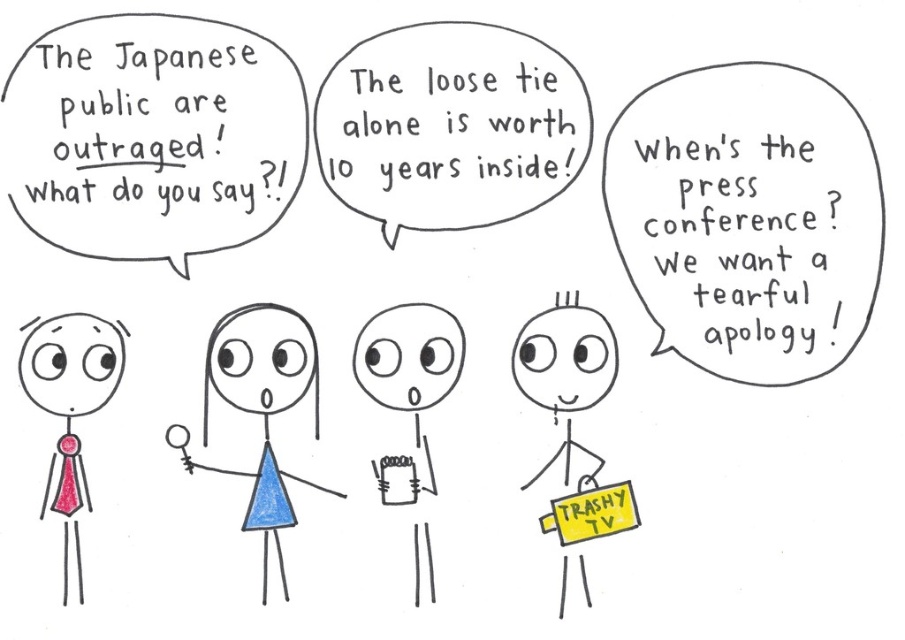
Question: Is yellow paper sign at lower right to the left of blue paper at center from the viewer's perspective?

Choices:
 (A) yes
 (B) no

Answer: (B)

Question: Estimate the real-world distances between objects in this image. Which object is farther from the yellow paper sign at lower right?

Choices:
 (A) matte pink tie at left
 (B) blue paper at center
 (C) blue paper doll at center

Answer: (A)

Question: Can you confirm if blue paper doll at center is thinner than matte pink tie at left?

Choices:
 (A) no
 (B) yes

Answer: (A)

Question: Which object appears closest to the camera in this image?

Choices:
 (A) blue paper doll at center
 (B) matte pink tie at left
 (C) blue paper at center
 (D) yellow paper sign at lower right

Answer: (B)

Question: Which object is the farthest from the matte pink tie at left?

Choices:
 (A) blue paper at center
 (B) yellow paper sign at lower right

Answer: (B)

Question: Is blue paper at center positioned before matte pink tie at left?

Choices:
 (A) yes
 (B) no

Answer: (B)